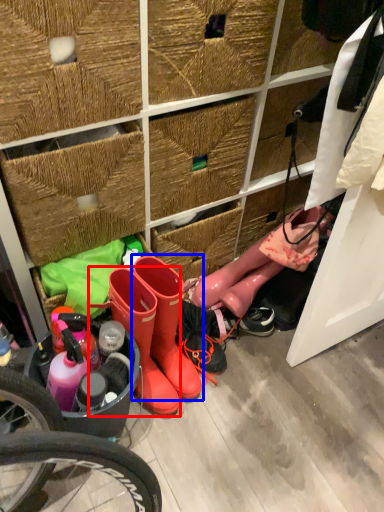
Question: Among these objects, which one is nearest to the camera, footwear (highlighted by a red box) or footwear (highlighted by a blue box)?

Choices:
 (A) footwear
 (B) footwear

Answer: (A)